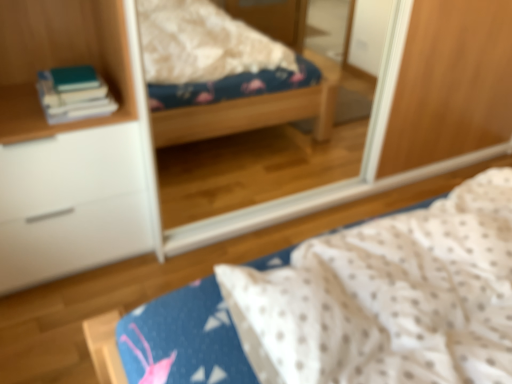
Question: Is clear glass mirror at upper center further to the viewer compared to white dotted fabric at center?

Choices:
 (A) yes
 (B) no

Answer: (A)

Question: Considering the relative sizes of clear glass mirror at upper center and white dotted fabric at center in the image provided, is clear glass mirror at upper center wider than white dotted fabric at center?

Choices:
 (A) no
 (B) yes

Answer: (A)

Question: Is clear glass mirror at upper center oriented towards white dotted fabric at center?

Choices:
 (A) yes
 (B) no

Answer: (B)

Question: From the image's perspective, is clear glass mirror at upper center beneath white dotted fabric at center?

Choices:
 (A) no
 (B) yes

Answer: (A)

Question: Does clear glass mirror at upper center lie in front of white dotted fabric at center?

Choices:
 (A) no
 (B) yes

Answer: (A)

Question: Is clear glass mirror at upper center not within white dotted fabric at center?

Choices:
 (A) no
 (B) yes

Answer: (B)

Question: Is clear glass mirror at upper center at the right side of white matte cabinet at left?

Choices:
 (A) no
 (B) yes

Answer: (B)

Question: Is clear glass mirror at upper center in contact with white matte cabinet at left?

Choices:
 (A) no
 (B) yes

Answer: (A)

Question: Is clear glass mirror at upper center bigger than white matte cabinet at left?

Choices:
 (A) yes
 (B) no

Answer: (A)

Question: Considering the relative sizes of clear glass mirror at upper center and white matte cabinet at left in the image provided, is clear glass mirror at upper center thinner than white matte cabinet at left?

Choices:
 (A) no
 (B) yes

Answer: (B)

Question: From the image's perspective, is clear glass mirror at upper center located above white matte cabinet at left?

Choices:
 (A) yes
 (B) no

Answer: (A)

Question: Is white matte cabinet at left surrounded by clear glass mirror at upper center?

Choices:
 (A) no
 (B) yes

Answer: (A)

Question: From a real-world perspective, is white matte cabinet at left on hardcover books at left?

Choices:
 (A) no
 (B) yes

Answer: (A)